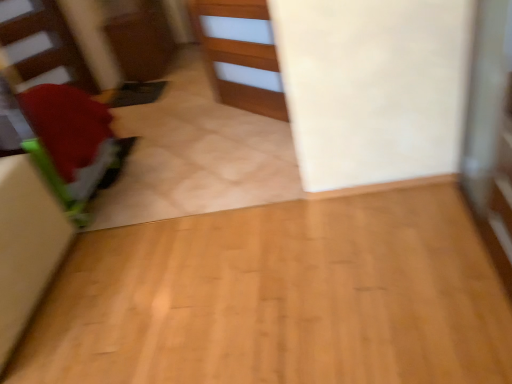
What are the coordinates of `vacant space underneath wooden cabinet at center (from a real-world perspective)` in the screenshot? It's located at (241, 122).